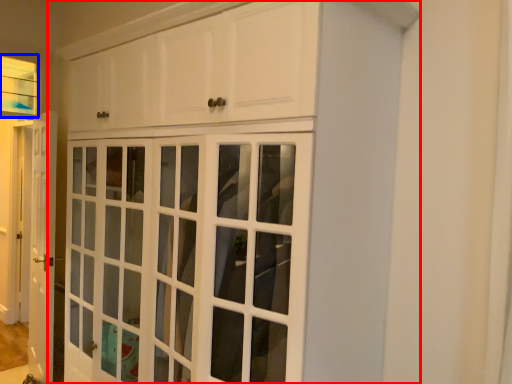
Question: Which of the following is the farthest to the observer, cupboard (highlighted by a red box) or window (highlighted by a blue box)?

Choices:
 (A) cupboard
 (B) window

Answer: (B)